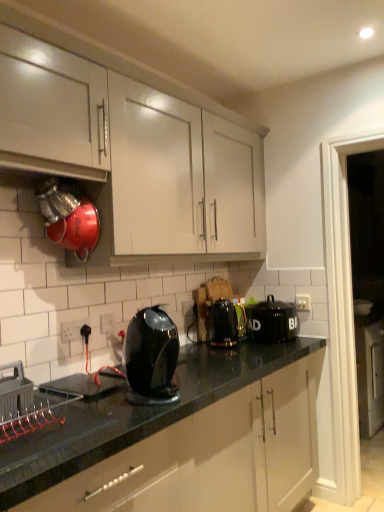
Question: Is metallic gray crate at lower left at the right side of white matte cabinet at upper left?

Choices:
 (A) yes
 (B) no

Answer: (B)

Question: From a real-world perspective, is metallic gray crate at lower left over white matte cabinet at upper left?

Choices:
 (A) no
 (B) yes

Answer: (A)

Question: Does metallic gray crate at lower left have a greater width compared to white matte cabinet at upper left?

Choices:
 (A) no
 (B) yes

Answer: (A)

Question: Does metallic gray crate at lower left have a greater height compared to white matte cabinet at upper left?

Choices:
 (A) yes
 (B) no

Answer: (B)

Question: Is metallic gray crate at lower left positioned before white matte cabinet at upper left?

Choices:
 (A) no
 (B) yes

Answer: (B)

Question: From a real-world perspective, relative to white plastic electric outlet at lower center, acting as the 2th electric outlet starting from the left, is black metallic kettle at center, arranged as the second kitchen appliance when viewed from the right, vertically above or below?

Choices:
 (A) above
 (B) below

Answer: (B)

Question: Is black metallic kettle at center, positioned as the second kitchen appliance in back-to-front order, bigger or smaller than white plastic electric outlet at lower center, acting as the 2th electric outlet starting from the left?

Choices:
 (A) big
 (B) small

Answer: (A)

Question: In terms of height, does black metallic kettle at center, arranged as the second kitchen appliance when viewed from the right, look taller or shorter compared to white plastic electric outlet at lower center, acting as the 2th electric outlet starting from the left?

Choices:
 (A) short
 (B) tall

Answer: (B)

Question: In the image, is black metallic kettle at center, the 2th kitchen appliance in the left-to-right sequence, positioned in front of or behind white plastic electric outlet at lower center, which is the second electric outlet in front-to-back order?

Choices:
 (A) front
 (B) behind

Answer: (B)

Question: Is black glossy kettle at center, which is the third kitchen appliance in back-to-front order, in front of or behind white plastic electric outlet at lower left, which ranks as the third electric outlet in right-to-left order, in the image?

Choices:
 (A) behind
 (B) front

Answer: (B)

Question: Considering the positions of black glossy kettle at center, acting as the 1th kitchen appliance starting from the left, and white plastic electric outlet at lower left, which ranks as the third electric outlet in right-to-left order, in the image, is black glossy kettle at center, acting as the 1th kitchen appliance starting from the left, bigger or smaller than white plastic electric outlet at lower left, which ranks as the third electric outlet in right-to-left order,?

Choices:
 (A) big
 (B) small

Answer: (A)

Question: Which is correct: black glossy kettle at center, acting as the 1th kitchen appliance starting from the left, is inside white plastic electric outlet at lower left, the 1th electric outlet viewed from the front, or outside of it?

Choices:
 (A) outside
 (B) inside

Answer: (A)

Question: In terms of width, does black glossy kettle at center, the 1th kitchen appliance viewed from the front, look wider or thinner when compared to white plastic electric outlet at lower left, the 1th electric outlet when ordered from left to right?

Choices:
 (A) wide
 (B) thin

Answer: (A)

Question: From a real-world perspective, is white plastic electric outlet at center, the 3th electric outlet from the front, above or below white plastic electric outlet at lower left, which ranks as the third electric outlet in right-to-left order?

Choices:
 (A) above
 (B) below

Answer: (A)

Question: Is white plastic electric outlet at center, the first electric outlet viewed from the back, to the left or to the right of white plastic electric outlet at lower left, the 1th electric outlet when ordered from left to right, in the image?

Choices:
 (A) left
 (B) right

Answer: (B)